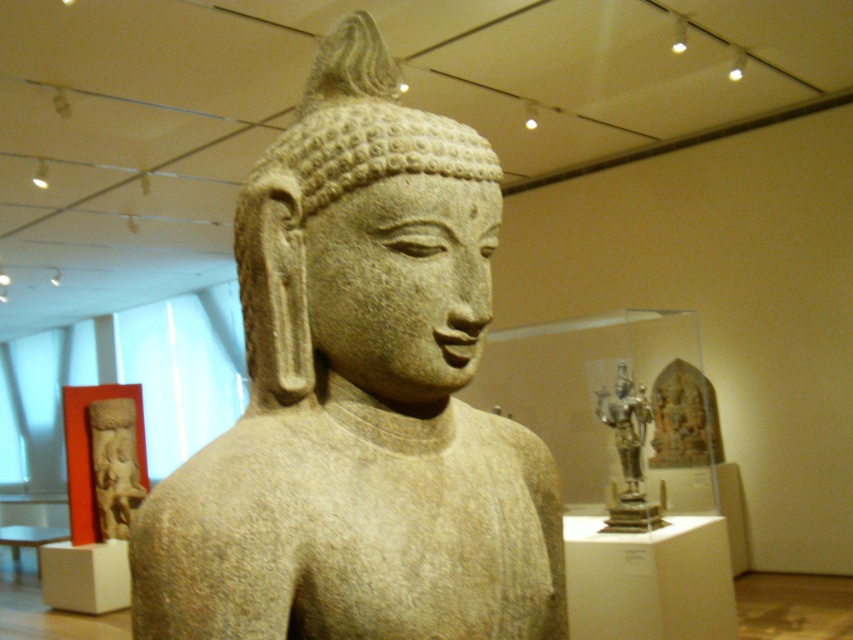
In the scene shown: Is gray stone head at center thinner than carved stone figure at left?

Yes.

Is point (294, 161) farther from viewer compared to point (102, 420)?

No, (294, 161) is in front of (102, 420).

Where is `gray stone head at center`? This screenshot has width=853, height=640. gray stone head at center is located at coordinates (329, 189).

Can you confirm if granite statue at center is taller than carved stone figure at left?

Incorrect, granite statue at center's height is not larger of carved stone figure at left's.

What do you see at coordinates (358, 397) in the screenshot? The width and height of the screenshot is (853, 640). I see `granite statue at center` at bounding box center [358, 397].

The image size is (853, 640). Describe the element at coordinates (358, 397) in the screenshot. I see `granite statue at center` at that location.

Locate an element on the screen. This screenshot has width=853, height=640. granite statue at center is located at coordinates (358, 397).

Is gray stone head at center below polished bronze statue at center?

No.

Is point (263, 179) farther from camera compared to point (636, 524)?

No, it is in front of (636, 524).

Locate an element on the screen. gray stone head at center is located at coordinates (329, 189).